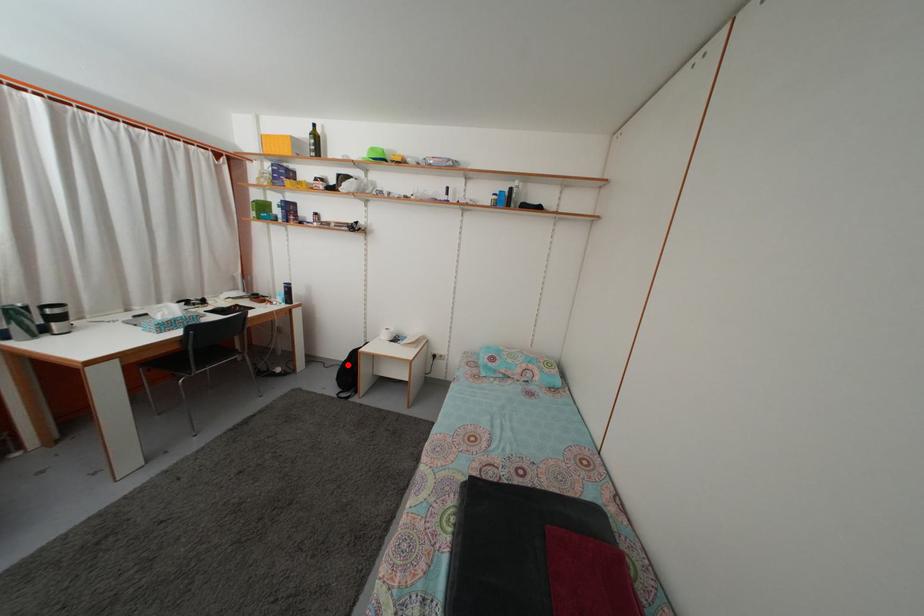
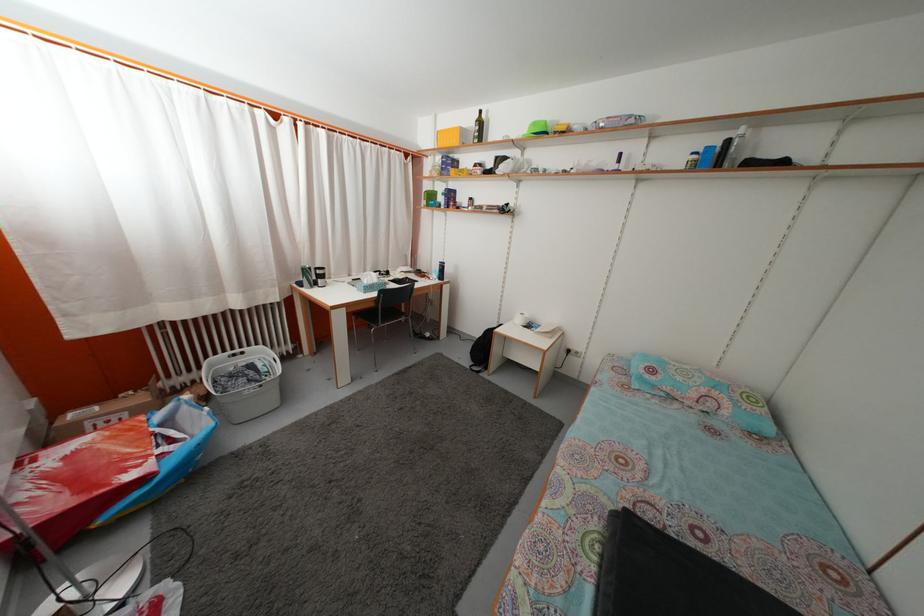
Question: A red point is marked in image1. In image2, is the corresponding 3D point closer to the camera or farther? Reply with the corresponding letter.

Choices:
 (A) The corresponding 3D point is closer.
 (B) The corresponding 3D point is farther.

Answer: (A)